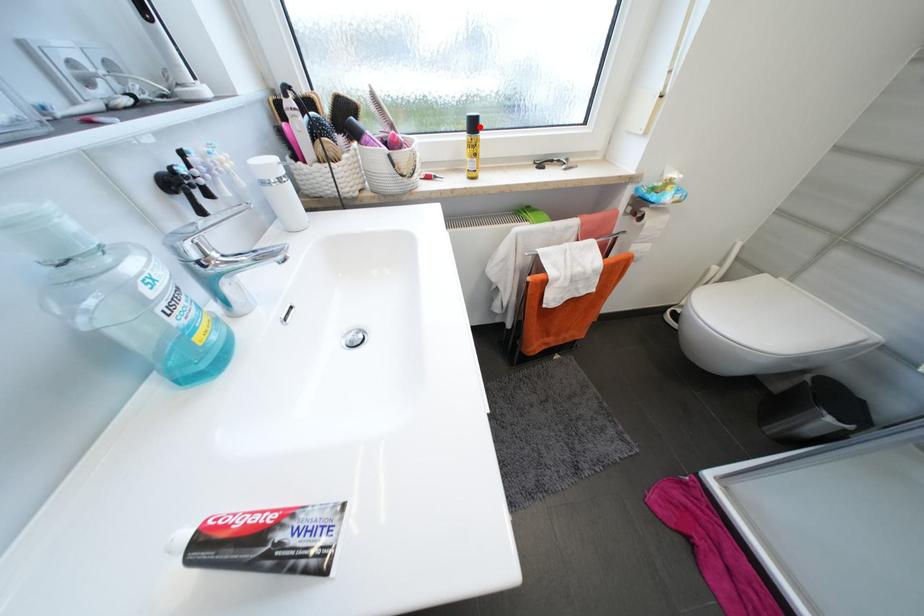
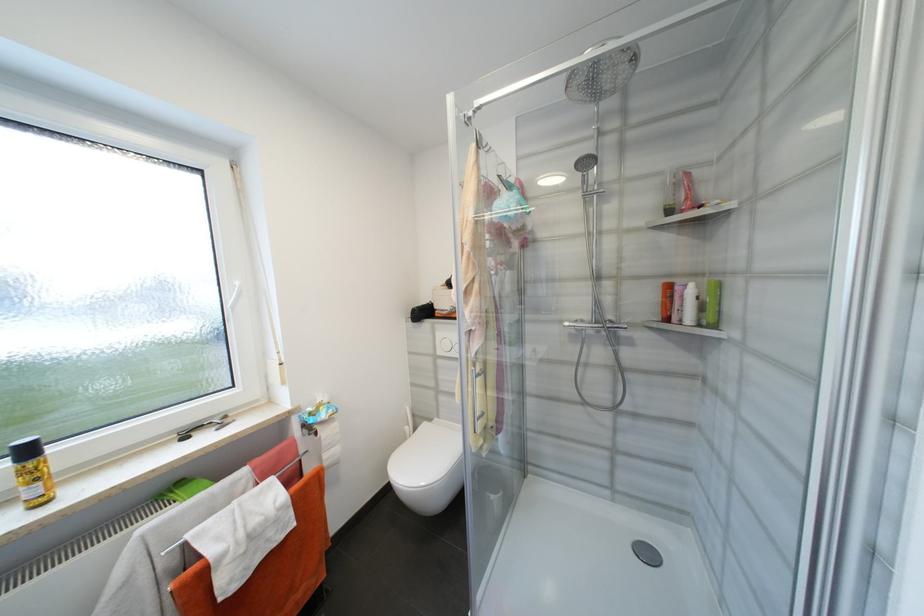
Locate, in the second image, the point that corresponds to the highlighted location in the first image.

(33, 453)